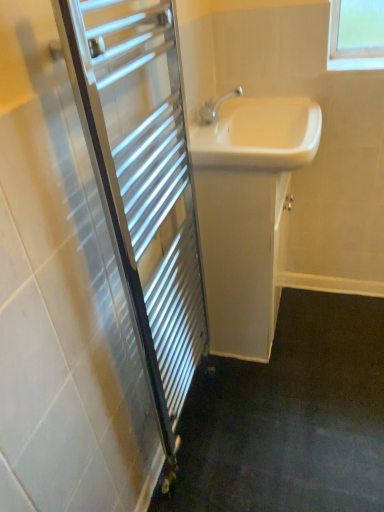
Question: From a real-world perspective, is chrome metallic towel rack at left under white glossy sink at center?

Choices:
 (A) yes
 (B) no

Answer: (A)

Question: Considering the relative sizes of chrome metallic towel rack at left and white glossy sink at center in the image provided, is chrome metallic towel rack at left shorter than white glossy sink at center?

Choices:
 (A) yes
 (B) no

Answer: (B)

Question: Does chrome metallic towel rack at left have a greater width compared to white glossy sink at center?

Choices:
 (A) yes
 (B) no

Answer: (B)

Question: Is chrome metallic towel rack at left facing towards white glossy sink at center?

Choices:
 (A) no
 (B) yes

Answer: (A)

Question: Can you confirm if chrome metallic towel rack at left is bigger than white glossy sink at center?

Choices:
 (A) no
 (B) yes

Answer: (B)

Question: Is chrome metallic towel rack at left closer to the viewer compared to white glossy sink at center?

Choices:
 (A) no
 (B) yes

Answer: (B)

Question: Considering the relative positions of white glossy cabinet at center and white glossy sink at center in the image provided, is white glossy cabinet at center to the right of white glossy sink at center from the viewer's perspective?

Choices:
 (A) yes
 (B) no

Answer: (B)

Question: Can white glossy sink at center be found inside white glossy cabinet at center?

Choices:
 (A) no
 (B) yes

Answer: (A)

Question: Is white glossy cabinet at center further to the viewer compared to white glossy sink at center?

Choices:
 (A) no
 (B) yes

Answer: (B)

Question: Is white glossy cabinet at center with white glossy sink at center?

Choices:
 (A) yes
 (B) no

Answer: (B)

Question: Is white glossy cabinet at center taller than white glossy sink at center?

Choices:
 (A) yes
 (B) no

Answer: (A)

Question: From the image's perspective, does white glossy cabinet at center appear lower than white glossy sink at center?

Choices:
 (A) yes
 (B) no

Answer: (A)

Question: Can you confirm if white glossy sink at center is wider than white glossy cabinet at center?

Choices:
 (A) no
 (B) yes

Answer: (B)